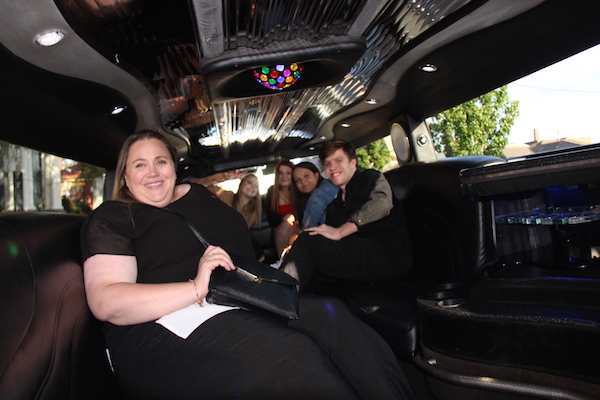
This screenshot has width=600, height=400. Find the location of `seats`. seats is located at coordinates (394, 296), (14, 290), (266, 233).